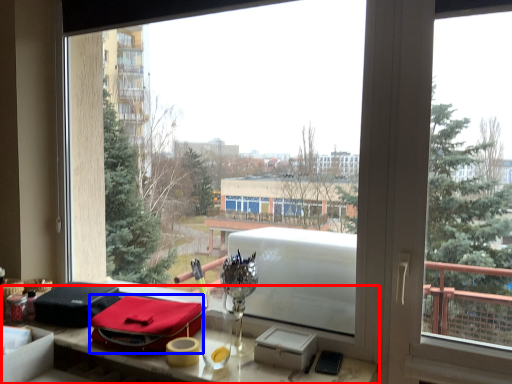
Question: Which point is closer to the camera, table (highlighted by a red box) or material (highlighted by a blue box)?

Choices:
 (A) table
 (B) material

Answer: (A)